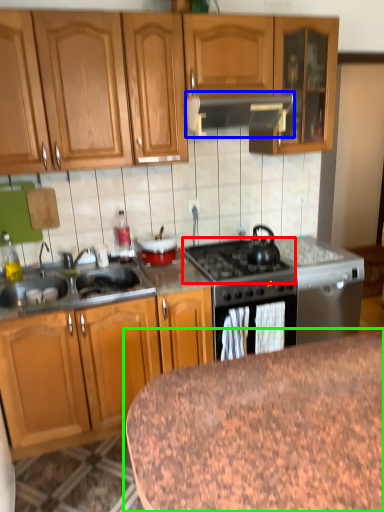
Question: Estimate the real-world distances between objects in this image. Which object is closer to gas stove (highlighted by a red box), kitchen appliance (highlighted by a blue box) or table (highlighted by a green box)?

Choices:
 (A) kitchen appliance
 (B) table

Answer: (A)